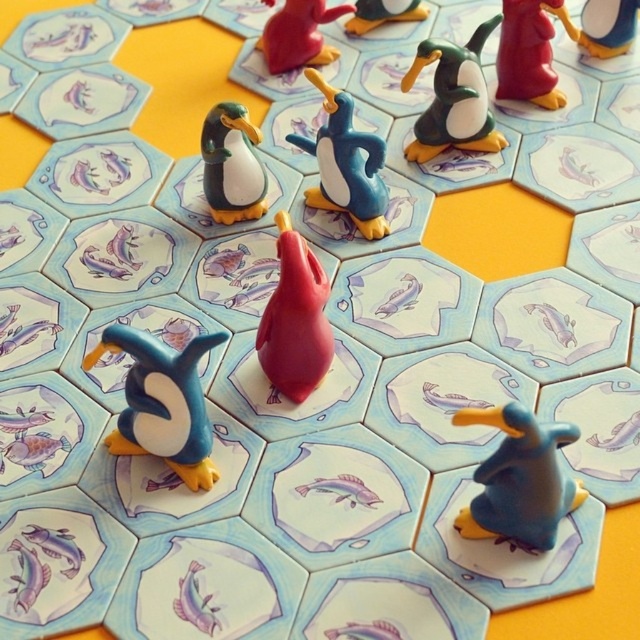
Question: Can you confirm if blue glossy penguin at center is positioned to the left of matte blue penguin at upper center?

Choices:
 (A) no
 (B) yes

Answer: (B)

Question: Can you confirm if blue glossy penguin at center is positioned to the left of matte plastic penguin at upper center?

Choices:
 (A) yes
 (B) no

Answer: (B)

Question: Which point is closer to the camera?

Choices:
 (A) (403, 10)
 (B) (280, 220)
 (C) (225, 204)

Answer: (B)

Question: Can you confirm if blue glossy penguin at center is thinner than matte plastic penguin at upper center?

Choices:
 (A) yes
 (B) no

Answer: (A)

Question: Which point is closer to the camera?

Choices:
 (A) coord(209,124)
 (B) coord(120,452)
 (C) coord(552,6)
 (D) coord(403,0)

Answer: (B)

Question: Estimate the real-world distances between objects in this image. Which object is closer to the shiny plastic penguin at upper right?

Choices:
 (A) matte plastic penguin at upper center
 (B) blue rubber penguin at lower right
 (C) matte red penguin at upper right
 (D) rubber duck at center

Answer: (C)